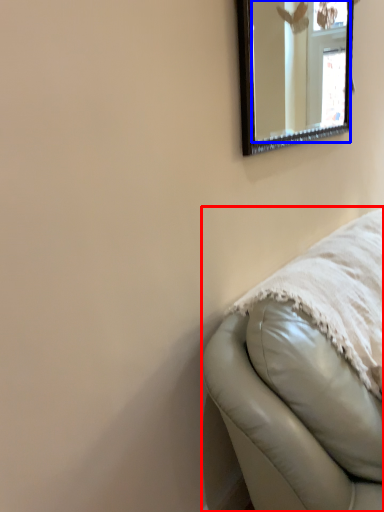
Question: Among these objects, which one is nearest to the camera, furniture (highlighted by a red box) or mirror (highlighted by a blue box)?

Choices:
 (A) furniture
 (B) mirror

Answer: (A)